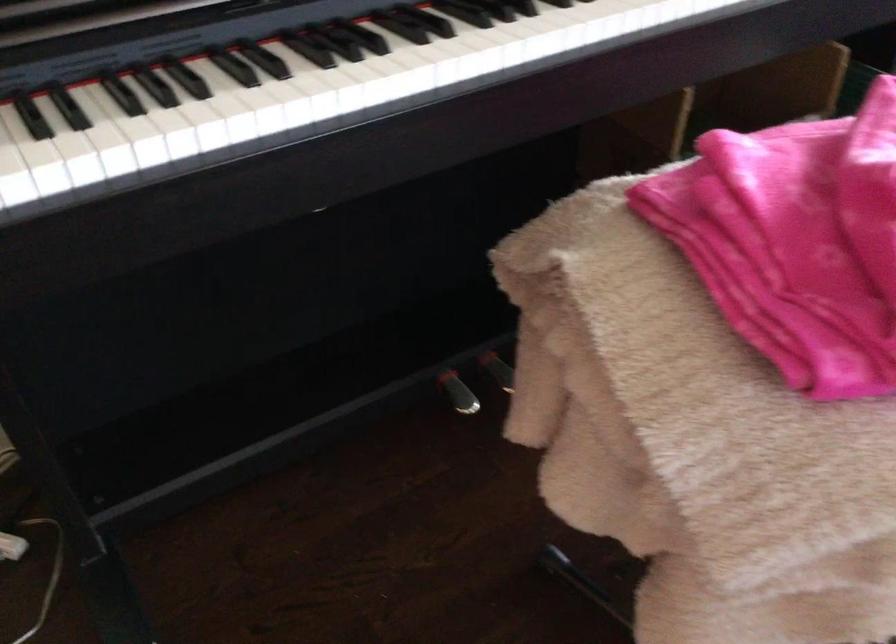
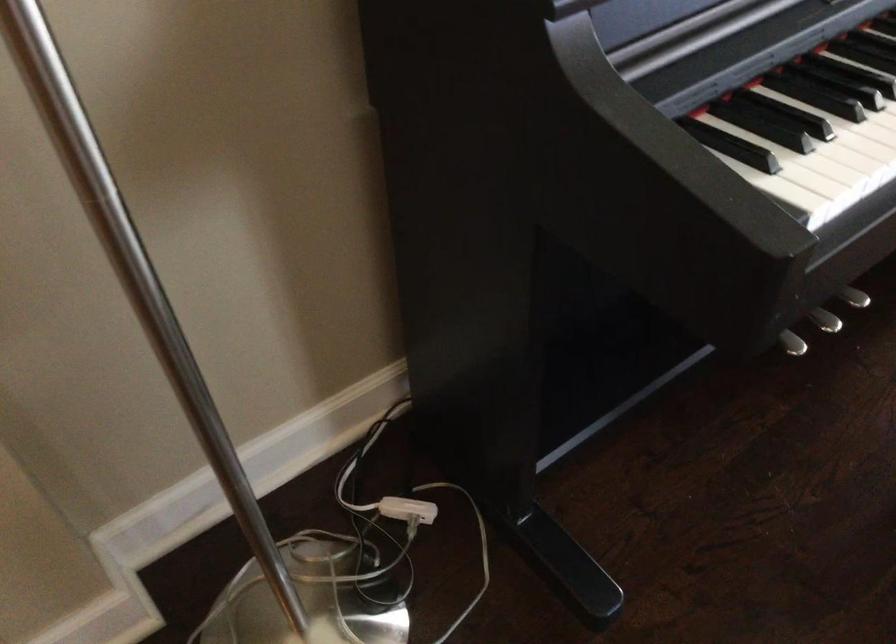
In the second image, find the point that corresponds to [113,104] in the first image.

(799, 100)